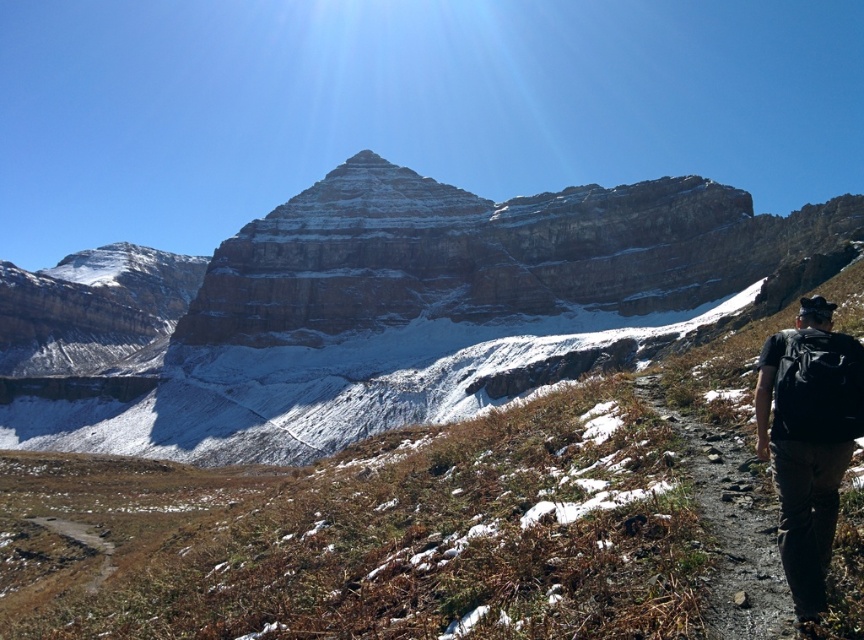
Which is in front, point (521, 221) or point (735, 566)?

Point (735, 566) is in front.

Is point (805, 208) less distant than point (670, 422)?

No, it is not.

The height and width of the screenshot is (640, 864). Describe the element at coordinates (399, 310) in the screenshot. I see `rugged stone mountain at center` at that location.

You are a GUI agent. You are given a task and a screenshot of the screen. Output one action in this format:
    pyautogui.click(x=<x>, y=<y>)
    Task: Click on the rugged stone mountain at center
    Image resolution: width=864 pixels, height=640 pixels.
    Given the screenshot: What is the action you would take?
    pyautogui.click(x=399, y=310)

Can you confirm if rugged stone mountain at center is thinner than black fabric backpack at right?

No.

Can you confirm if rugged stone mountain at center is positioned below black fabric backpack at right?

No, rugged stone mountain at center is not below black fabric backpack at right.

Is point (524, 305) positioned behind point (791, 349)?

Yes.

You are a GUI agent. You are given a task and a screenshot of the screen. Output one action in this format:
    pyautogui.click(x=<x>, y=<y>)
    Task: Click on the rugged stone mountain at center
    The height and width of the screenshot is (640, 864).
    Given the screenshot: What is the action you would take?
    pyautogui.click(x=399, y=310)

Does black fabric backpack at right appear on the left side of dirt path at lower right?

Incorrect, black fabric backpack at right is not on the left side of dirt path at lower right.

Who is positioned more to the right, black fabric backpack at right or dirt path at lower right?

black fabric backpack at right is more to the right.

Is point (812, 580) positioned in front of point (779, 620)?

Yes, it is.

Where is `black fabric backpack at right`? black fabric backpack at right is located at coordinates (808, 440).